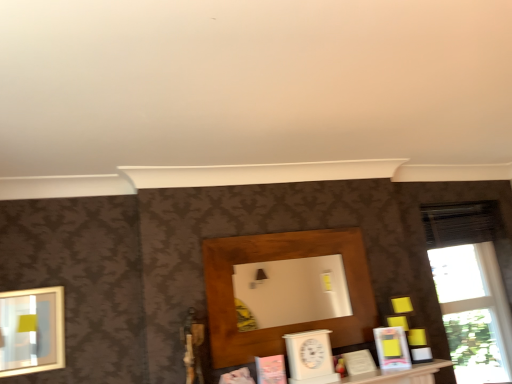
Question: Is matte pink book at center, acting as the 1th book starting from the left, in front of or behind transparent glass window at right in the image?

Choices:
 (A) behind
 (B) front

Answer: (B)

Question: In terms of height, does matte pink book at center, acting as the 1th book starting from the left, look taller or shorter compared to transparent glass window at right?

Choices:
 (A) tall
 (B) short

Answer: (B)

Question: Which is farther from the matte yellow book at lower right, acting as the fourth book starting from the left?

Choices:
 (A) white wooden clock at lower center
 (B) matte gold picture frame at left
 (C) wooden shelf at center
 (D) white matte book at center, which appears as the 3th book when viewed from the left
 (E) pink matte book at center, which is the third book in right-to-left order

Answer: (B)

Question: Estimate the real-world distances between objects in this image. Which object is closer to the matte gold picture frame at left?

Choices:
 (A) matte yellow book at lower right, acting as the fourth book starting from the left
 (B) white matte book at center, the second book in the right-to-left sequence
 (C) matte pink book at center, the fourth book positioned from the right
 (D) wooden shelf at center
 (E) pink matte book at center, which appears as the 2th book when viewed from the left

Answer: (C)